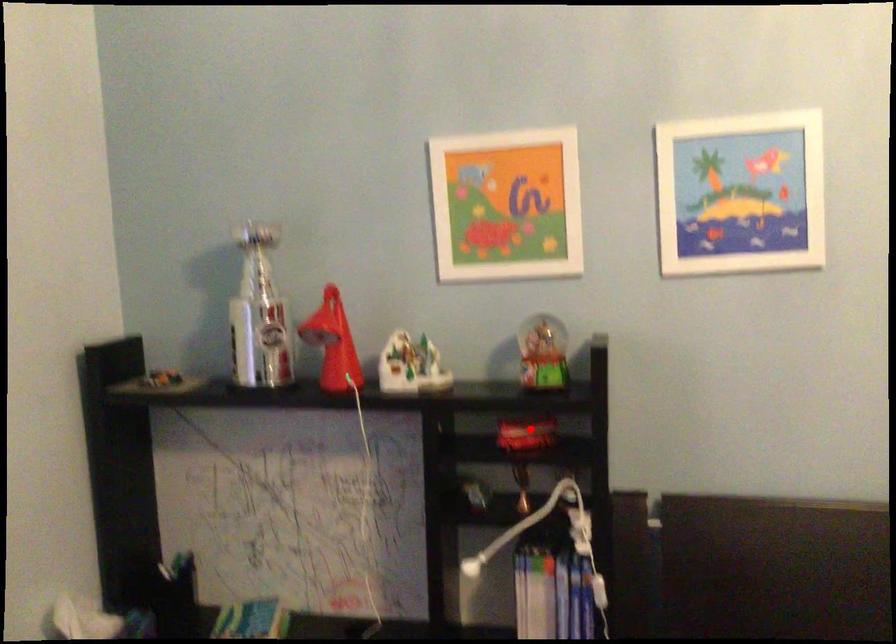
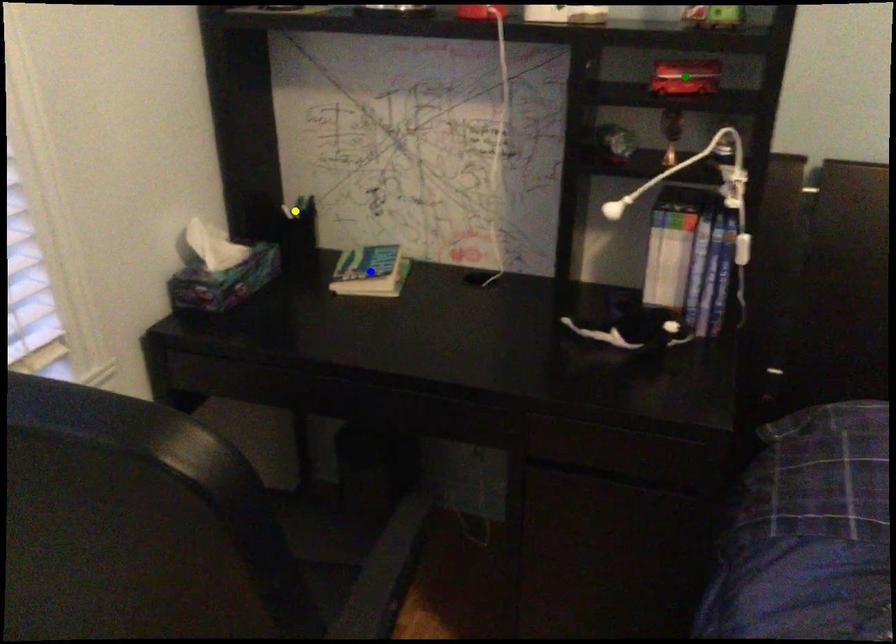
Question: I am providing you with two images of the same scene from different viewpoints. A red point is marked on the first image. You are given multiple points on the second image. Which point in image 2 is actually the same real-world point as the red point in image 1?

Choices:
 (A) yellow point
 (B) green point
 (C) blue point

Answer: (B)